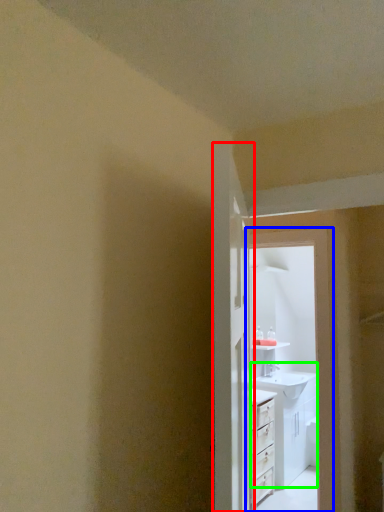
Question: Which object is positioned closest to door (highlighted by a red box)? Select from screen door (highlighted by a blue box) and sink (highlighted by a green box).

Choices:
 (A) screen door
 (B) sink

Answer: (A)